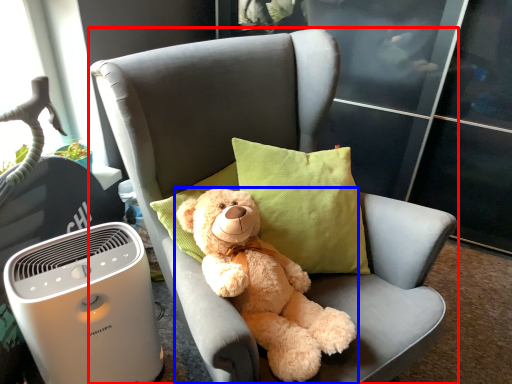
Question: Among these objects, which one is nearest to the camera, chair (highlighted by a red box) or teddy bear (highlighted by a blue box)?

Choices:
 (A) chair
 (B) teddy bear

Answer: (A)